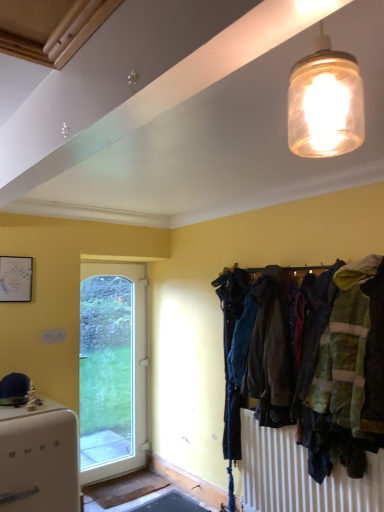
Question: Considering their positions, is dark blue fabric coat at center right located in front of or behind white matte refrigerator at lower left?

Choices:
 (A) front
 (B) behind

Answer: (B)

Question: Considering the positions of point (253, 381) and point (79, 498), is point (253, 381) closer or farther from the camera than point (79, 498)?

Choices:
 (A) closer
 (B) farther

Answer: (B)

Question: Which of these objects is positioned farthest from the white glossy door at left?

Choices:
 (A) dark blue fabric coat at center right
 (B) translucent glass jar at upper center
 (C) white matte refrigerator at lower left

Answer: (B)

Question: Which is nearer to the dark blue fabric coat at center right?

Choices:
 (A) white glossy door at left
 (B) translucent glass jar at upper center
 (C) white matte refrigerator at lower left

Answer: (C)